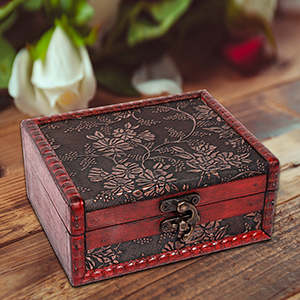
This screenshot has height=300, width=300. In order to click on red wooden box in this screenshot , I will do `click(105, 224)`.